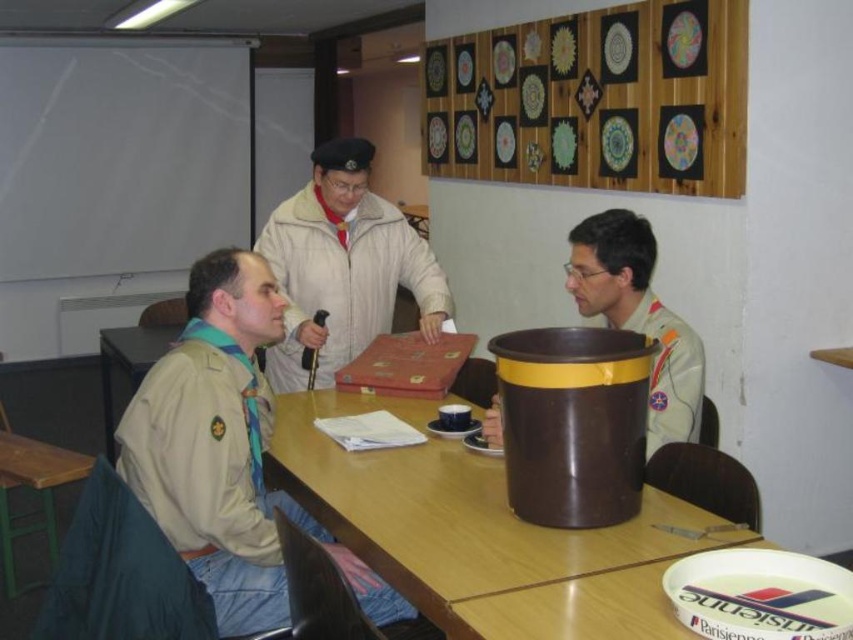
Question: Which point is farther to the camera?

Choices:
 (A) wooden wall with colorful circular designs at upper center
 (B) beige woolen jacket at center
 (C) wooden table at center

Answer: (C)

Question: Among these points, which one is farthest from the camera?

Choices:
 (A) (70, 451)
 (B) (492, 417)
 (C) (248, 604)
 (D) (328, 164)

Answer: (A)

Question: Is brown matte trash can at right closer to the viewer compared to wooden table at center?

Choices:
 (A) no
 (B) yes

Answer: (B)

Question: Does brown plastic bucket at center have a greater width compared to wooden table at center?

Choices:
 (A) yes
 (B) no

Answer: (B)

Question: Among these points, which one is farthest from the camera?

Choices:
 (A) (619, 280)
 (B) (387, 529)
 (C) (281, 252)

Answer: (C)

Question: Is brown plastic bucket at center thinner than wooden table at lower left?

Choices:
 (A) no
 (B) yes

Answer: (A)